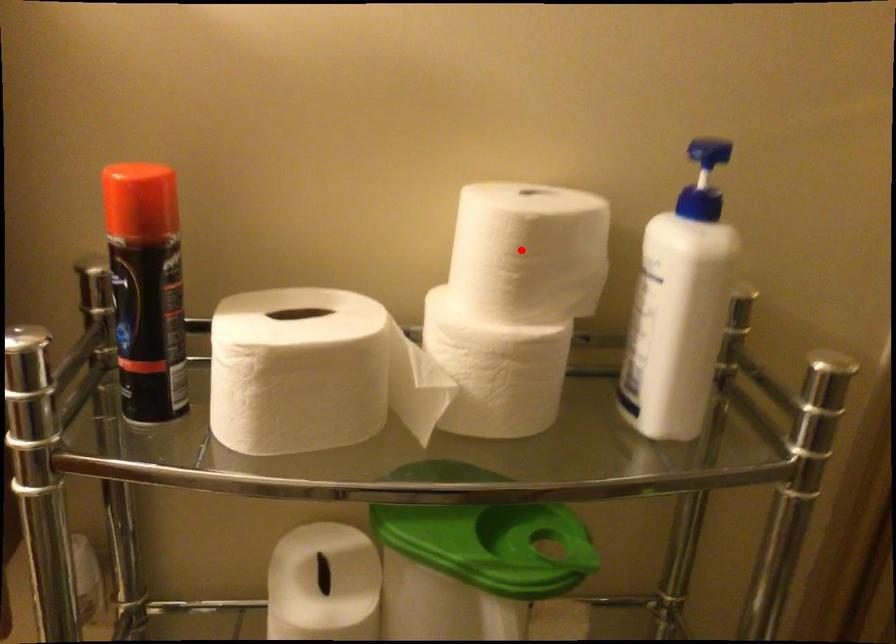
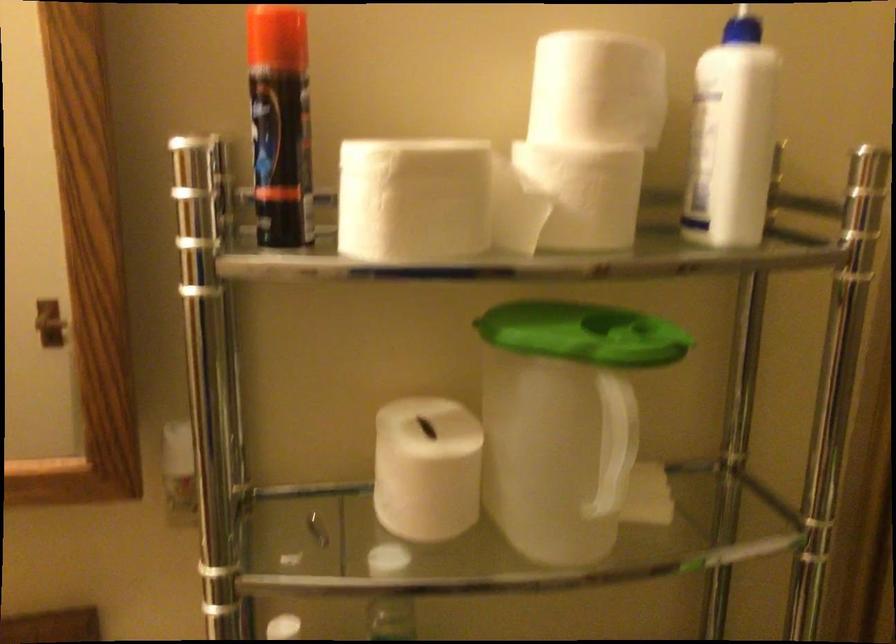
Find the pixel in the second image that matches the highlighted location in the first image.

(597, 89)